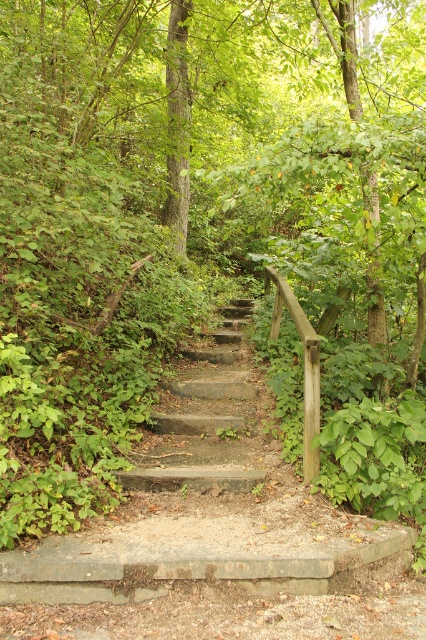
Question: Does concrete steps at center appear on the left side of gray concrete stairs at center?

Choices:
 (A) yes
 (B) no

Answer: (A)

Question: Observing the image, what is the correct spatial positioning of concrete steps at center in reference to gray concrete stairs at center?

Choices:
 (A) right
 (B) left

Answer: (B)

Question: Among these objects, which one is farthest from the camera?

Choices:
 (A) gray concrete stairs at center
 (B) concrete steps at center

Answer: (A)

Question: Among these objects, which one is nearest to the camera?

Choices:
 (A) concrete steps at center
 (B) gray concrete stairs at center

Answer: (A)

Question: Considering the relative positions of concrete steps at center and gray concrete stairs at center in the image provided, where is concrete steps at center located with respect to gray concrete stairs at center?

Choices:
 (A) left
 (B) right

Answer: (A)